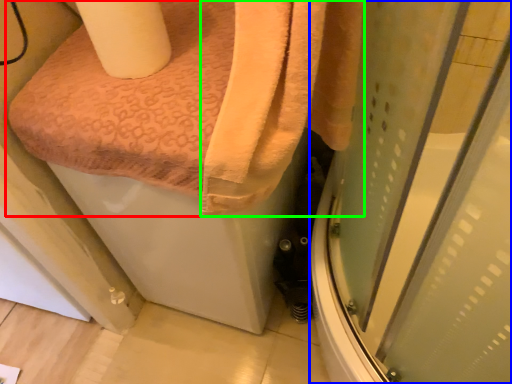
Question: Based on their relative distances, which object is farther from towel (highlighted by a red box)? Choose from screen door (highlighted by a blue box) and bath towel (highlighted by a green box).

Choices:
 (A) screen door
 (B) bath towel

Answer: (A)